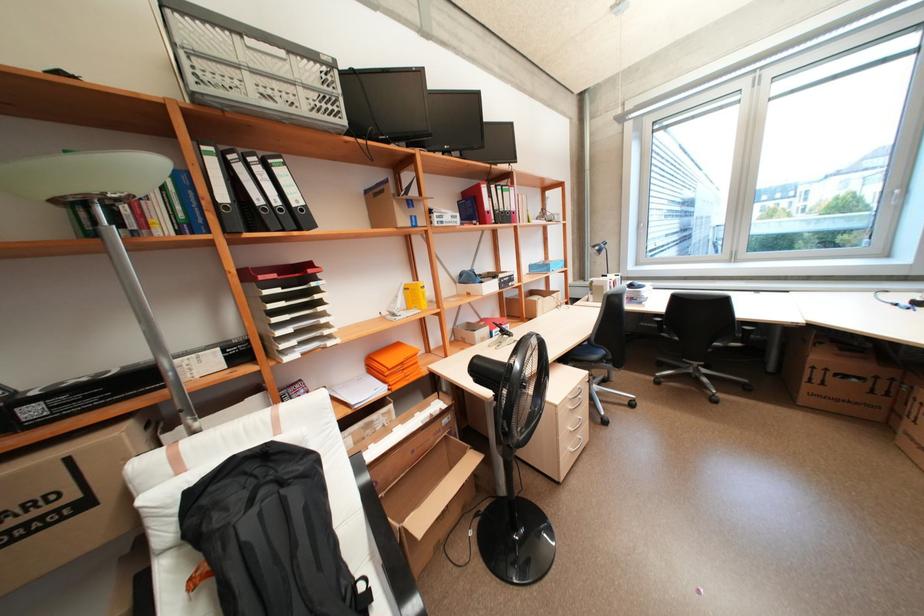
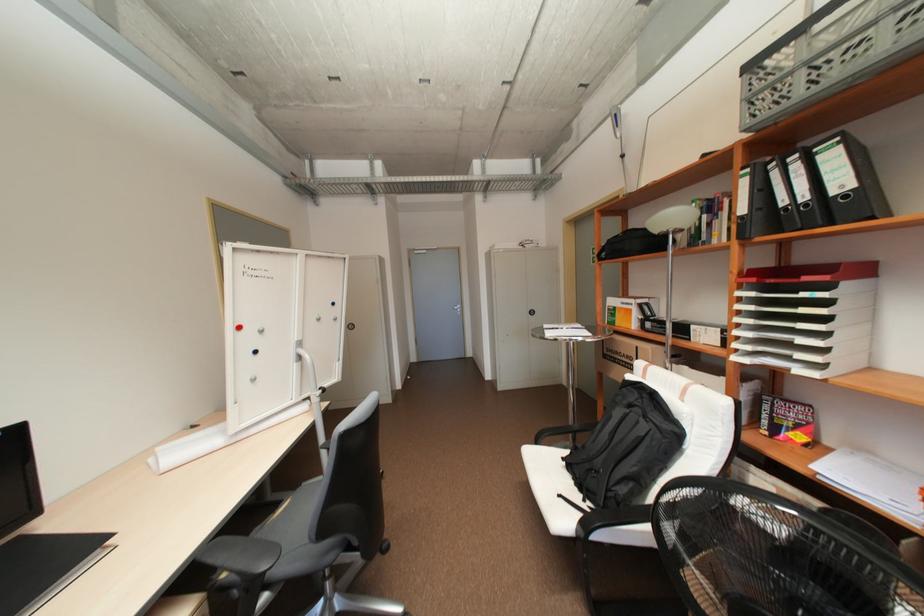
The point at (293, 359) is marked in the first image. Where is the corresponding point in the second image?

(742, 358)